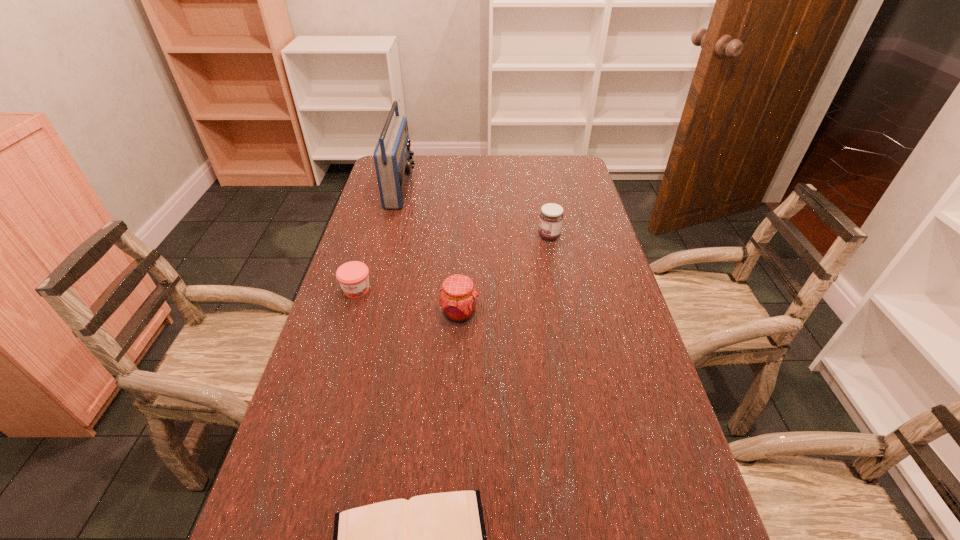
Where is `vacant space located on the front label of the rightmost jam`? The width and height of the screenshot is (960, 540). vacant space located on the front label of the rightmost jam is located at coordinates (500, 236).

Locate an element on the screen. The height and width of the screenshot is (540, 960). free space located 0.080m on the front label of the rightmost jam is located at coordinates (513, 236).

Identify the location of free point located on the front label of the fourth tallest object. (347, 323).

Where is `object that is positioned at the far edge`? object that is positioned at the far edge is located at coordinates (393, 161).

Locate an element on the screen. Image resolution: width=960 pixels, height=540 pixels. radio receiver that is at the left edge is located at coordinates (393, 161).

Find the location of a particular element. Image resolution: width=960 pixels, height=540 pixels. jam that is at the left edge is located at coordinates (353, 277).

The image size is (960, 540). In order to click on object located in the right edge section of the desktop in this screenshot , I will do `click(551, 216)`.

You are a GUI agent. You are given a task and a screenshot of the screen. Output one action in this format:
    pyautogui.click(x=<x>, y=<y>)
    Task: Click on the object positioned at the far left corner
    
    Given the screenshot: What is the action you would take?
    pyautogui.click(x=393, y=161)

This screenshot has width=960, height=540. I want to click on free space at the far edge of the desktop, so pos(490,171).

Image resolution: width=960 pixels, height=540 pixels. What are the coordinates of `vacant space at the left edge of the desktop` in the screenshot? It's located at (360, 233).